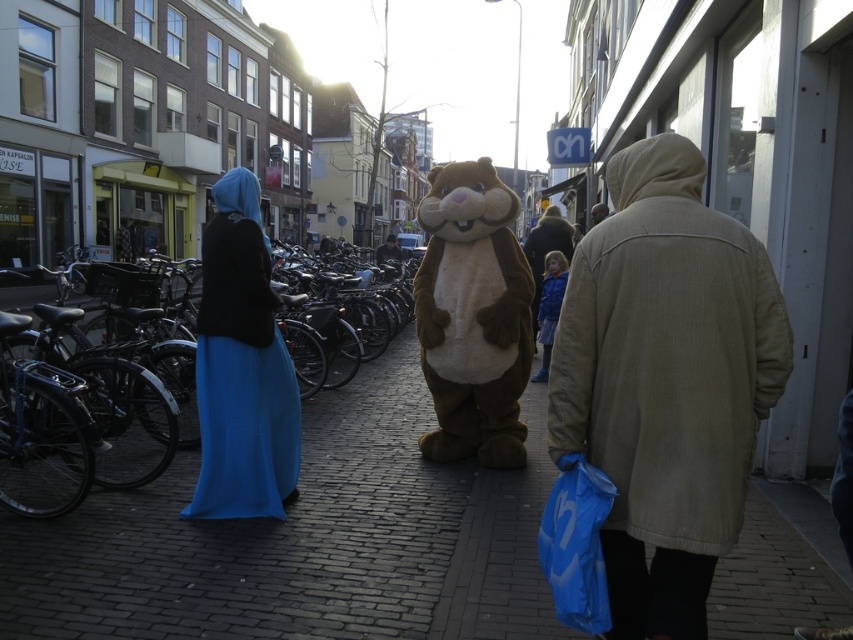
In the scene shown: Who is more forward, (x=762, y=499) or (x=550, y=209)?

Point (x=762, y=499) is in front.

Who is more forward, (543, 452) or (548, 221)?

Point (543, 452)

Identify the location of brick pavement at center. The width and height of the screenshot is (853, 640). (305, 540).

Which is behind, point (537, 314) or point (554, 326)?

The point (537, 314) is behind.

Can you confirm if blue corduroy jacket at center is taller than blue fabric coat at center?

No, blue corduroy jacket at center is not taller than blue fabric coat at center.

Is point (535, 307) closer to camera compared to point (546, 276)?

No, (535, 307) is further to viewer.

This screenshot has height=640, width=853. In order to click on blue corduroy jacket at center in this screenshot , I will do `click(546, 250)`.

Is fuzzy brown teddy at center to the left of blue fabric coat at center from the viewer's perspective?

Correct, you'll find fuzzy brown teddy at center to the left of blue fabric coat at center.

Is fuzzy brown teddy at center wider than blue fabric coat at center?

Correct, the width of fuzzy brown teddy at center exceeds that of blue fabric coat at center.

Measure the distance between fuzzy brown teddy at center and camera.

The distance of fuzzy brown teddy at center from camera is 5.10 meters.

Identify the location of fuzzy brown teddy at center. [473, 316].